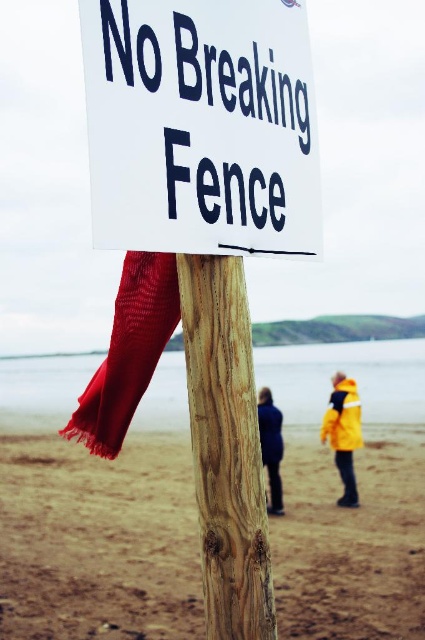
You are a photographer trying to capture the white plastic sign at center and the dark blue jacket at center in the same frame. Based on their sizes in the image, which object would appear bigger in your photo?

The white plastic sign at center appears bigger in the photo because its width is larger than that of the dark blue jacket at center.

You are standing on the beach and want to walk from the wooden post at center to the yellow matte jacket at lower right. In which direction should you go?

The wooden post at center is positioned on the left side of the yellow matte jacket at lower right, so you should walk to the right to reach the yellow matte jacket at lower right.